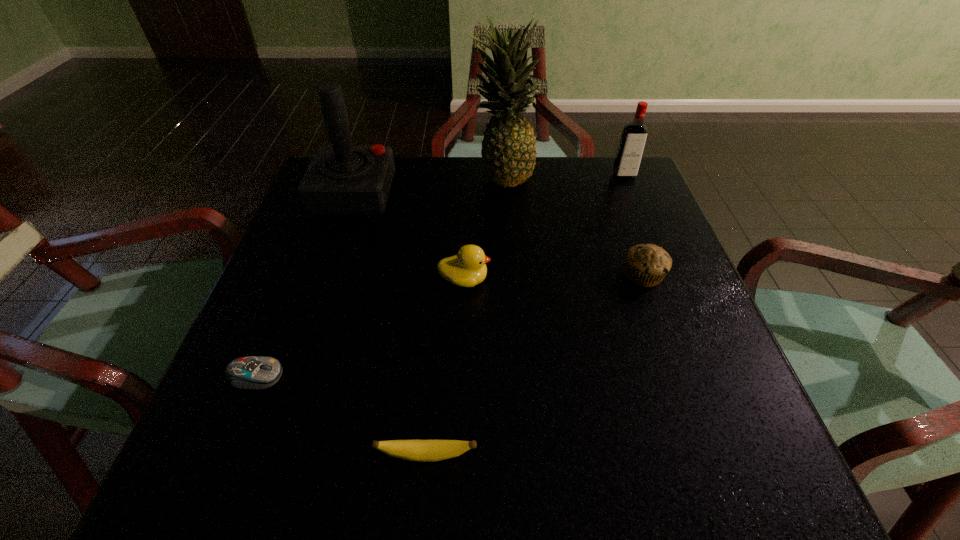
Where is `vacant area that lies between the vodka and the muffin`? Image resolution: width=960 pixels, height=540 pixels. vacant area that lies between the vodka and the muffin is located at coordinates 634,226.

Where is `vacant space that is in between the pineapple and the vodka`? The image size is (960, 540). vacant space that is in between the pineapple and the vodka is located at coordinates (563, 176).

This screenshot has width=960, height=540. I want to click on blank region between the tallest object and the shortest object, so click(x=378, y=275).

In order to click on vacant space that's between the sixth farthest object and the fifth tallest object in this screenshot , I will do `click(449, 326)`.

At what (x,y) coordinates should I click in order to perform the action: click on vacant area that lies between the joystick and the sixth tallest object. Please return your answer as a coordinate pair (x, y). Image resolution: width=960 pixels, height=540 pixels. Looking at the image, I should click on (390, 325).

You are a GUI agent. You are given a task and a screenshot of the screen. Output one action in this format:
    pyautogui.click(x=<x>, y=<y>)
    Task: Click on the vacant area that lies between the fourth shortest object and the muffin
    The width and height of the screenshot is (960, 540).
    Given the screenshot: What is the action you would take?
    pyautogui.click(x=554, y=278)

Where is `free spot between the joystick and the pineapple`? free spot between the joystick and the pineapple is located at coordinates (428, 184).

Where is `free point between the fifth shortest object and the duckling`? free point between the fifth shortest object and the duckling is located at coordinates click(544, 228).

Identify the location of vacant space in between the sixth farthest object and the third tallest object. The image size is (960, 540). 440,276.

At what (x,y) coordinates should I click in order to perform the action: click on free space between the vodka and the tallest object. Please return your answer as a coordinate pair (x, y). This screenshot has width=960, height=540. Looking at the image, I should click on (563, 176).